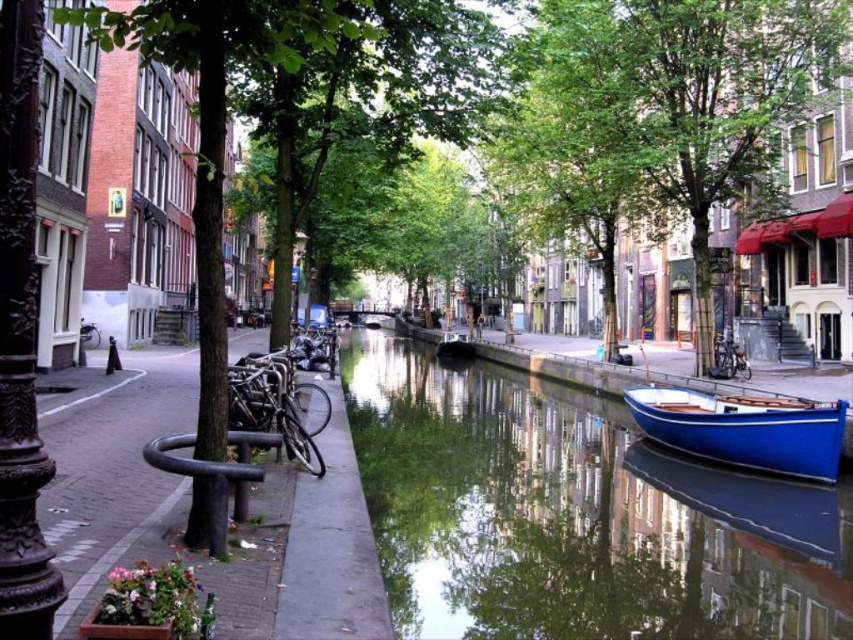
Between brown concrete pavement at lower left and metallic silver lamp post at center, which one has less height?

brown concrete pavement at lower left is shorter.

Who is more distant from viewer, (62, 604) or (306, 237)?

Point (306, 237)

Between point (231, 614) and point (299, 244), which one is positioned behind?

The point (299, 244) is more distant.

This screenshot has height=640, width=853. What are the coordinates of `brown concrete pavement at lower left` in the screenshot? It's located at (114, 472).

Which is more to the right, brown concrete pavement at lower left or white painted line at lower left?

From the viewer's perspective, brown concrete pavement at lower left appears more on the right side.

Locate an element on the screen. Image resolution: width=853 pixels, height=640 pixels. brown concrete pavement at lower left is located at coordinates (114, 472).

The height and width of the screenshot is (640, 853). What are the coordinates of `brown concrete pavement at lower left` in the screenshot? It's located at (114, 472).

Does green reflective water at center appear under blue glossy boat at center?

Indeed, green reflective water at center is positioned under blue glossy boat at center.

Which is behind, point (564, 400) or point (473, 342)?

Point (473, 342)

Between point (735, 493) and point (445, 348), which one is positioned in front?

Positioned in front is point (735, 493).

Where is `green reflective water at center`? This screenshot has height=640, width=853. green reflective water at center is located at coordinates (573, 515).